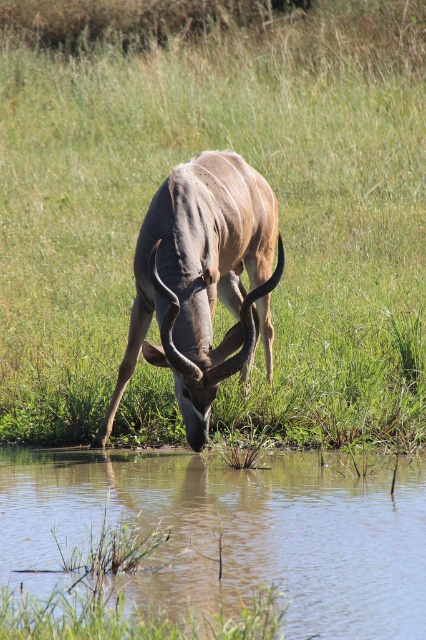
From the picture: Which is more to the left, clear water at lower center or grayish-brown horned animal at center?

clear water at lower center

Between point (262, 560) and point (187, 308), which one is positioned behind?

Point (187, 308)

This screenshot has width=426, height=640. Identify the location of clear water at lower center. (233, 532).

Does point (284, 332) come farther from viewer compared to point (207, 536)?

Yes, it is behind point (207, 536).

Between green grass at center and clear water at lower center, which one is positioned higher?

green grass at center is higher up.

Find the location of a particular element. Image resolution: width=426 pixels, height=640 pixels. green grass at center is located at coordinates (192, 157).

Does green grass at center appear over grayish-brown horned animal at center?

Yes.

Find the location of `green grass at center`. green grass at center is located at coordinates (192, 157).